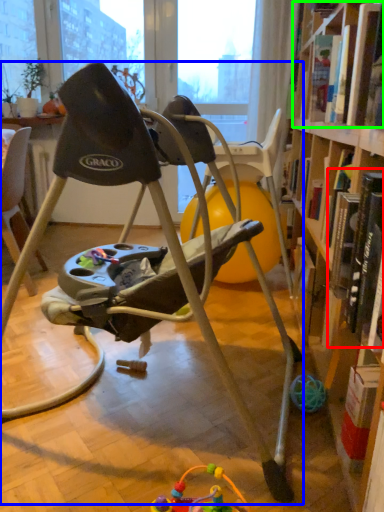
Question: Which object is positioned farthest from book (highlighted by a red box)? Select from chair (highlighted by a blue box) and book (highlighted by a green box).

Choices:
 (A) chair
 (B) book

Answer: (B)